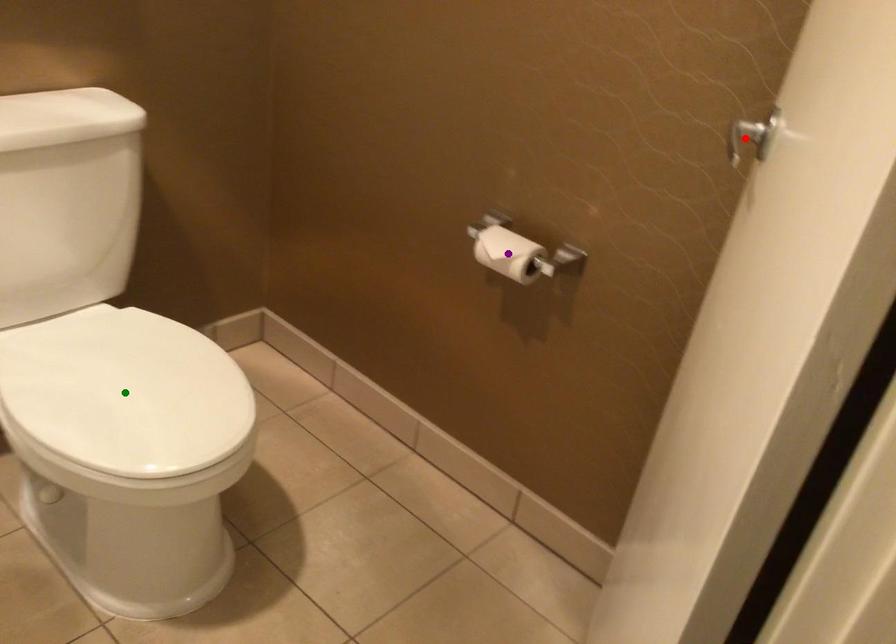
Order these from nearest to farthest:
purple point | red point | green point

purple point → green point → red point